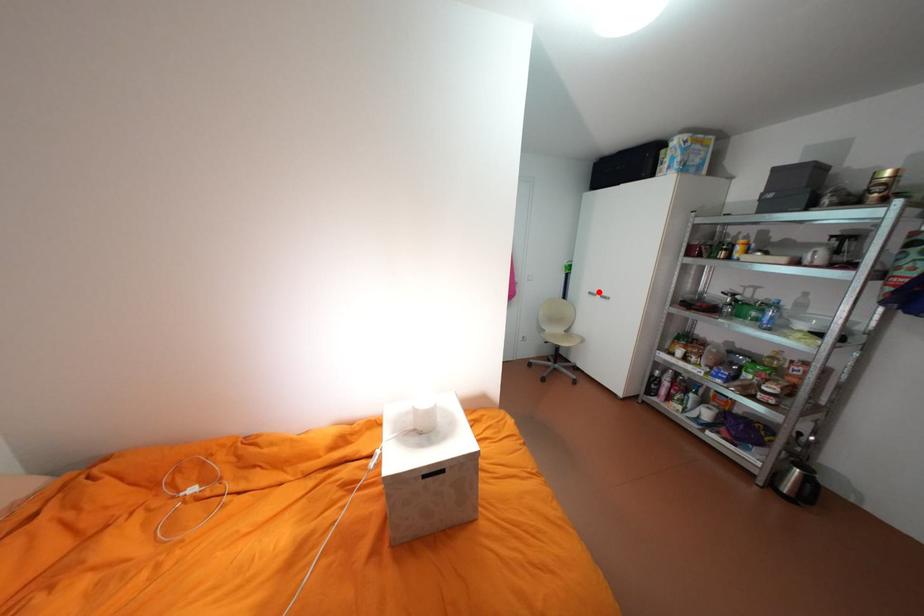
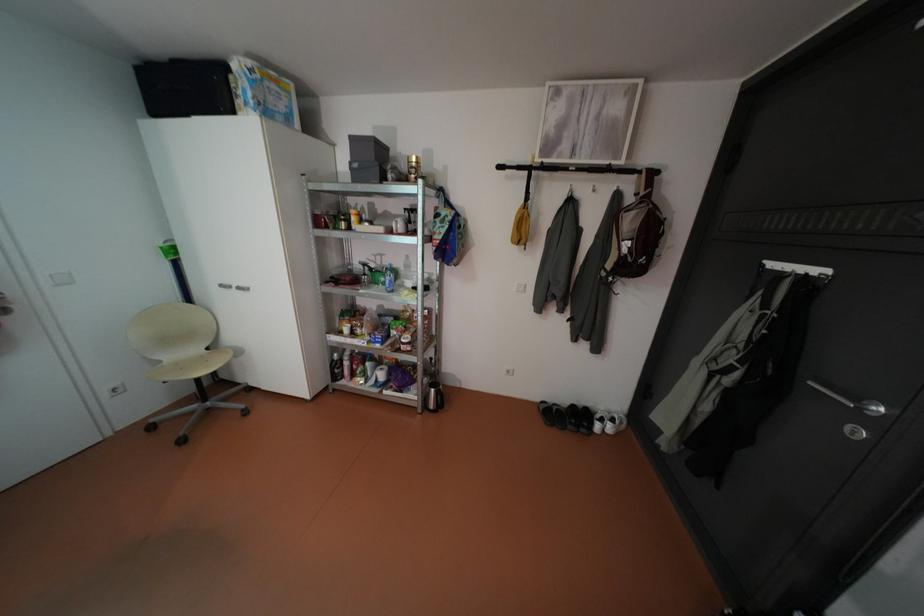
Find the pixel in the second image that matches the highlighted location in the first image.

(232, 285)